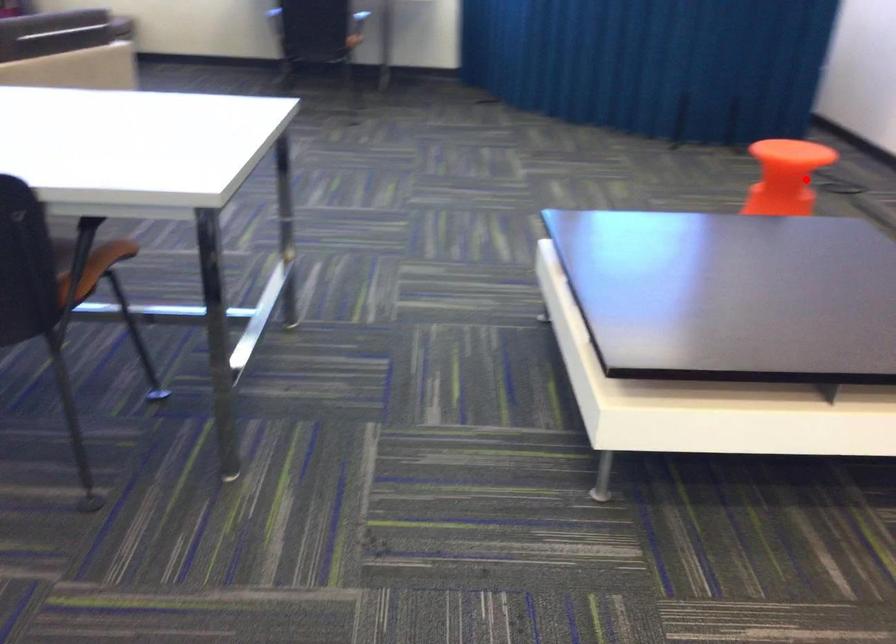
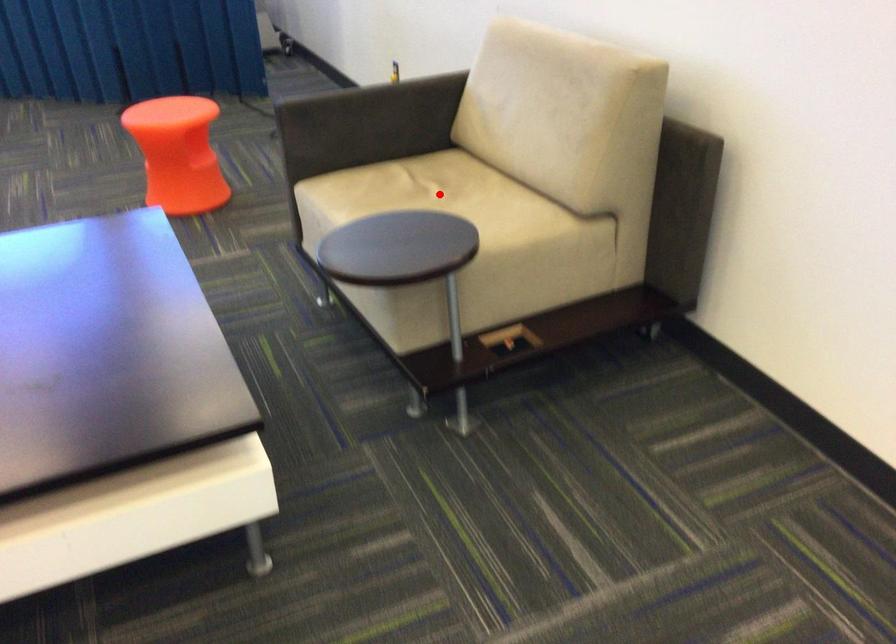
I am providing you with two images of the same scene from different viewpoints. A red point is marked on the first image and another point is marked on the second image. Do the highlighted points in image1 and image2 indicate the same real-world spot?

No